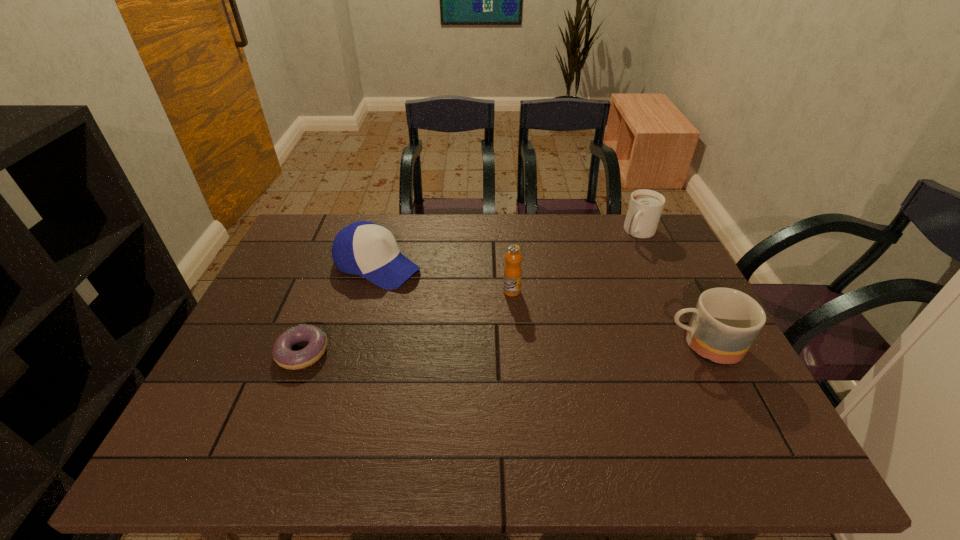
Identify the location of object that is the third closest one to the baseball cap. The width and height of the screenshot is (960, 540). (725, 322).

You are a GUI agent. You are given a task and a screenshot of the screen. Output one action in this format:
    pyautogui.click(x=<x>, y=<y>)
    Task: Click on the vacant space that satisfies the following two spatial constraints: 1. on the front side of the mug; 2. on the side with the handle of the cappuccino
    
    Given the screenshot: What is the action you would take?
    pyautogui.click(x=692, y=345)

Identify the location of blank area in the image that satisfies the following two spatial constraints: 1. on the front side of the mug; 2. on the side with the handle of the third object from left to right. The image size is (960, 540). [516, 345].

Where is `vacant point that satisfies the following two spatial constraints: 1. on the front side of the mug; 2. on the side with the handle of the cappuccino`? Image resolution: width=960 pixels, height=540 pixels. vacant point that satisfies the following two spatial constraints: 1. on the front side of the mug; 2. on the side with the handle of the cappuccino is located at coordinates (692, 345).

Where is `vacant point that satisfies the following two spatial constraints: 1. on the back side of the shortest object; 2. on the left side of the cappuccino`? vacant point that satisfies the following two spatial constraints: 1. on the back side of the shortest object; 2. on the left side of the cappuccino is located at coordinates (348, 233).

You are a GUI agent. You are given a task and a screenshot of the screen. Output one action in this format:
    pyautogui.click(x=<x>, y=<y>)
    Task: Click on the free space that satisfies the following two spatial constraints: 1. on the back side of the doughnut; 2. on the right side of the cappuccino
    The image size is (960, 540).
    Given the screenshot: What is the action you would take?
    point(348,233)